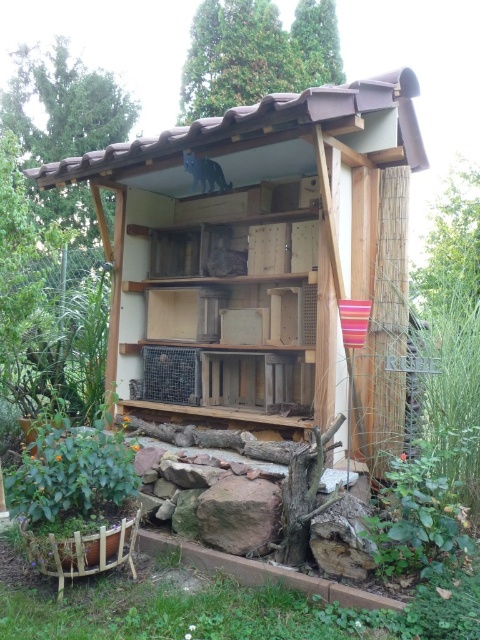
You are a small bird looking for a place to rest. You see a wooden birdhouse at center and a brown rough rock at lower center. Which one is higher up?

The wooden birdhouse at center is above the brown rough rock at lower center, so the wooden birdhouse at center is higher up.

You are a small animal trying to reach the wooden birdhouse at center from the brown rough rock at lower center. The animal can jump up to 3 feet. Can it make the jump?

The distance between the wooden birdhouse at center and the brown rough rock at lower center is 3.66 feet. Since the animal can only jump up to 3 feet, it cannot make the jump.

You are a photographer standing in front of the wooden insect hotel. You notice two points marked on the structure. The first point is at coordinates point (259, 177) and the second is at point (252, 524). If you want to take a photo that captures both points clearly, which point should you focus on first to ensure both are in focus?

You should focus on point (259, 177) first because it is closer to the camera than point (252, 524). By focusing on the closer point, the farther point will also be within the depth of field, ensuring both are in focus.